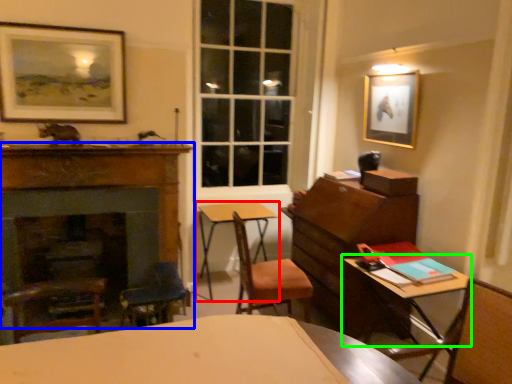
Question: Estimate the real-world distances between objects in this image. Which object is farther from table (highlighted by a red box), fireplace (highlighted by a blue box) or table (highlighted by a green box)?

Choices:
 (A) fireplace
 (B) table

Answer: (B)